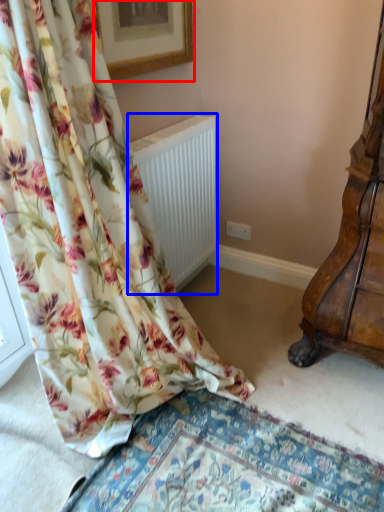
Question: Which point is further to the camera, picture frame (highlighted by a red box) or radiator (highlighted by a blue box)?

Choices:
 (A) picture frame
 (B) radiator

Answer: (B)